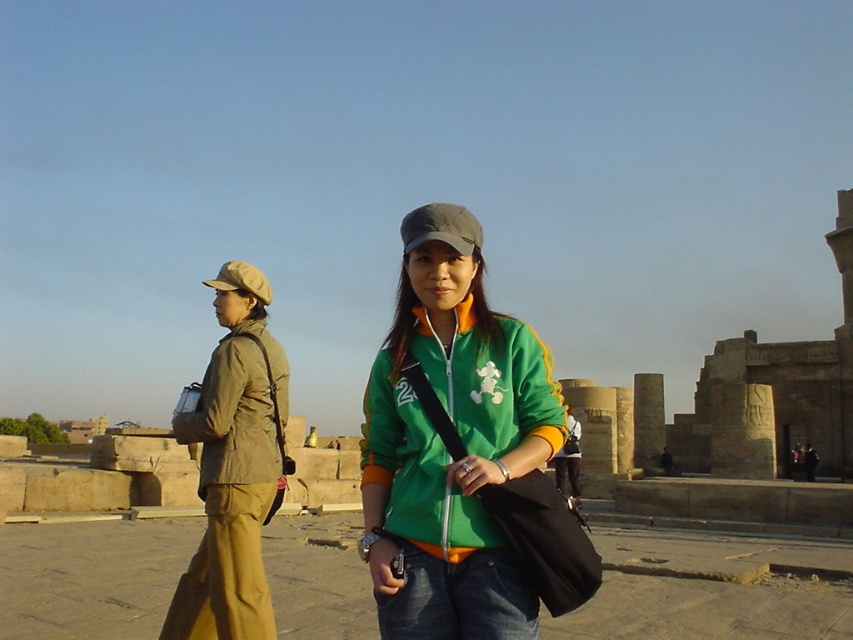
Question: Which object is closer to the camera taking this photo?

Choices:
 (A) green matte jacket at center
 (B) tan fabric baseball cap at left
 (C) khaki fabric jacket at left

Answer: (A)

Question: Can you confirm if green matte jacket at center is positioned to the right of tan fabric jacket at left?

Choices:
 (A) no
 (B) yes

Answer: (B)

Question: Which object is positioned closest to the green matte jacket at center?

Choices:
 (A) tan fabric jacket at left
 (B) khaki fabric jacket at left
 (C) green fabric baseball cap at center
 (D) tan fabric baseball cap at left

Answer: (A)

Question: From the image, what is the correct spatial relationship of khaki fabric jacket at left in relation to green fabric baseball cap at center?

Choices:
 (A) left
 (B) right

Answer: (A)

Question: Which of these objects is positioned farthest from the green fabric baseball cap at center?

Choices:
 (A) tan fabric jacket at left
 (B) khaki fabric jacket at left
 (C) tan fabric baseball cap at left
 (D) green matte jacket at center

Answer: (C)

Question: Can you confirm if green matte jacket at center is positioned to the right of tan fabric jacket at left?

Choices:
 (A) no
 (B) yes

Answer: (B)